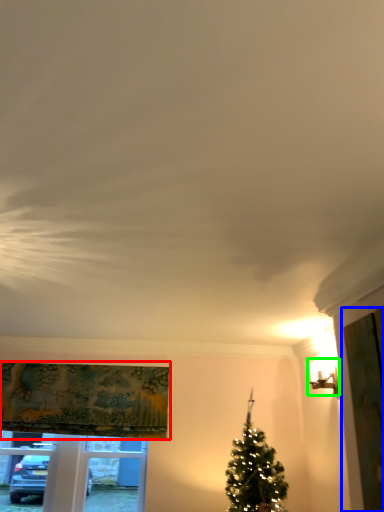
Question: Considering the real-world distances, which object is farthest from curtain (highlighted by a red box)? screen door (highlighted by a blue box) or light fixture (highlighted by a green box)?

Choices:
 (A) screen door
 (B) light fixture

Answer: (A)